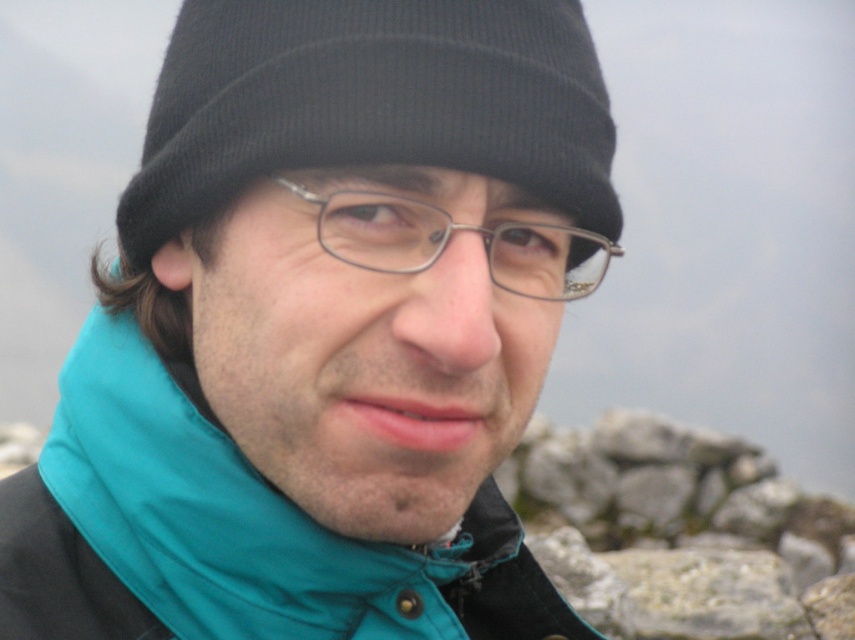
Does black knit hat at upper center have a greater width compared to metallic rectangular glasses at center?

Yes.

The width and height of the screenshot is (855, 640). I want to click on black knit hat at upper center, so click(x=370, y=104).

This screenshot has width=855, height=640. In order to click on black knit hat at upper center in this screenshot , I will do `click(370, 104)`.

Does teal fabric jacket at center have a lesser width compared to metallic rectangular glasses at center?

Incorrect, teal fabric jacket at center's width is not less than metallic rectangular glasses at center's.

Measure the distance between point (139, 465) and camera.

Point (139, 465) is 4.14 feet from camera.

Does point (488, 579) lie behind point (304, 198)?

Yes, point (488, 579) is farther from viewer.

In order to click on teal fabric jacket at center in this screenshot , I will do `click(323, 332)`.

Which of these two, teal fabric jacket at center or black knit hat at upper center, stands taller?

With more height is teal fabric jacket at center.

Is teal fabric jacket at center thinner than black knit hat at upper center?

No.

The height and width of the screenshot is (640, 855). What do you see at coordinates (323, 332) in the screenshot?
I see `teal fabric jacket at center` at bounding box center [323, 332].

The image size is (855, 640). What are the coordinates of `teal fabric jacket at center` in the screenshot? It's located at (323, 332).